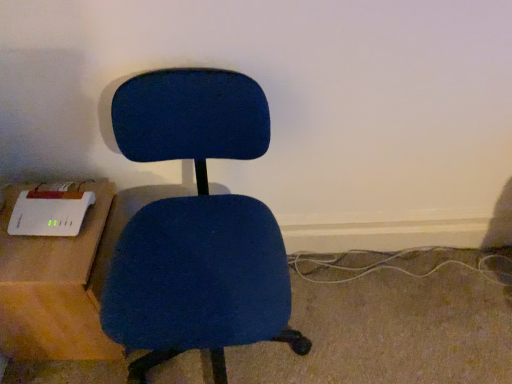
You are a GUI agent. You are given a task and a screenshot of the screen. Output one action in this format:
    pyautogui.click(x=<x>, y=<y>)
    Task: Click on the vacant region above white plastic router at left (from a real-world perspective)
    
    Given the screenshot: What is the action you would take?
    pyautogui.click(x=32, y=231)